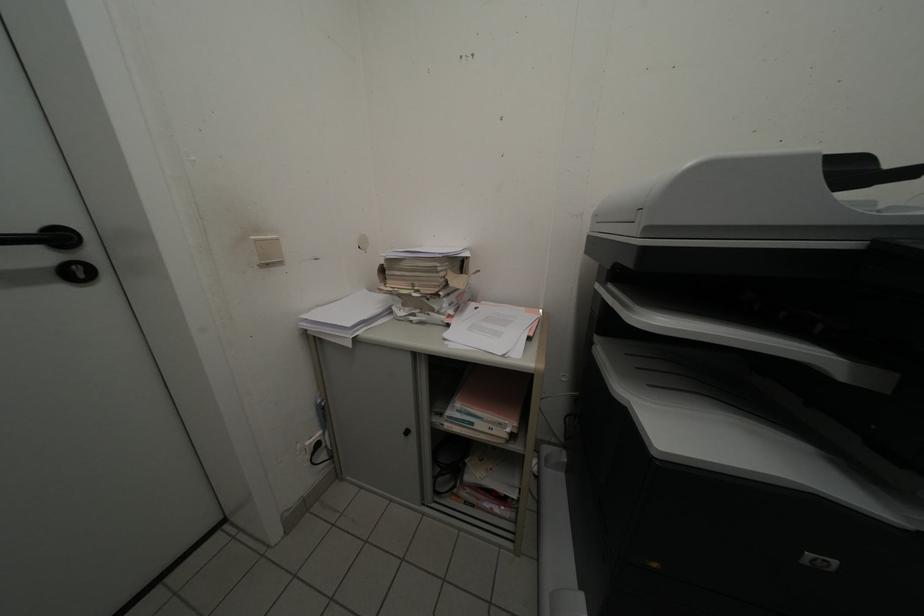
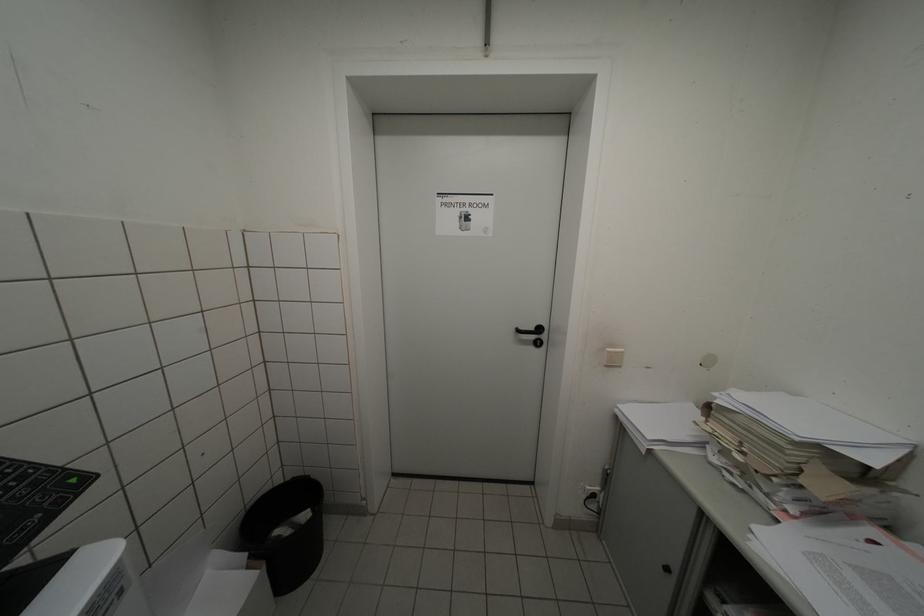
Find the pixel in the second image that matches [261,240] in the first image.

(615, 352)